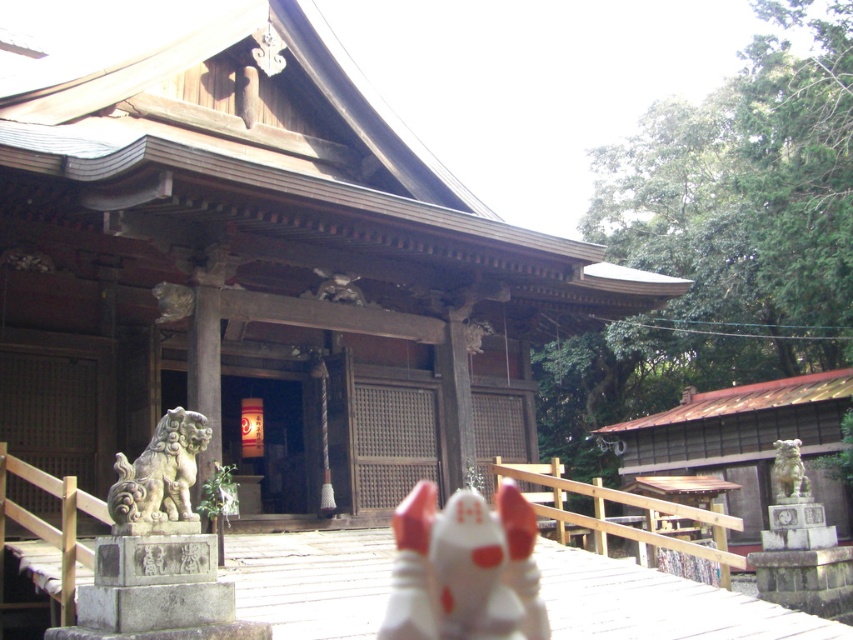
You are standing at the entrance of the temple and want to place a new decorative lantern at the point marked by coordinates (x=160, y=476). Which object is currently occupying that location?

The gray stone lion at left is located at point (x=160, y=476).

You are a temple visitor who wants to place a 15 feet long banner between the white matte fox at center and the smooth stone statue at center. Is there enough space to stretch the banner between them without folding it?

The distance between the white matte fox at center and the smooth stone statue at center is 18.42 feet, which is more than enough to stretch a 15 feet long banner between them without folding.

You are a visitor standing in front of the temple and see both the white matte fox at center and the smooth stone statue at center. Which one do you need to walk towards to get closer to the temple entrance?

The white matte fox at center is closer to the viewer than the smooth stone statue at center, so to get closer to the temple entrance, you should walk towards the white matte fox at center as it is nearer to your current position.